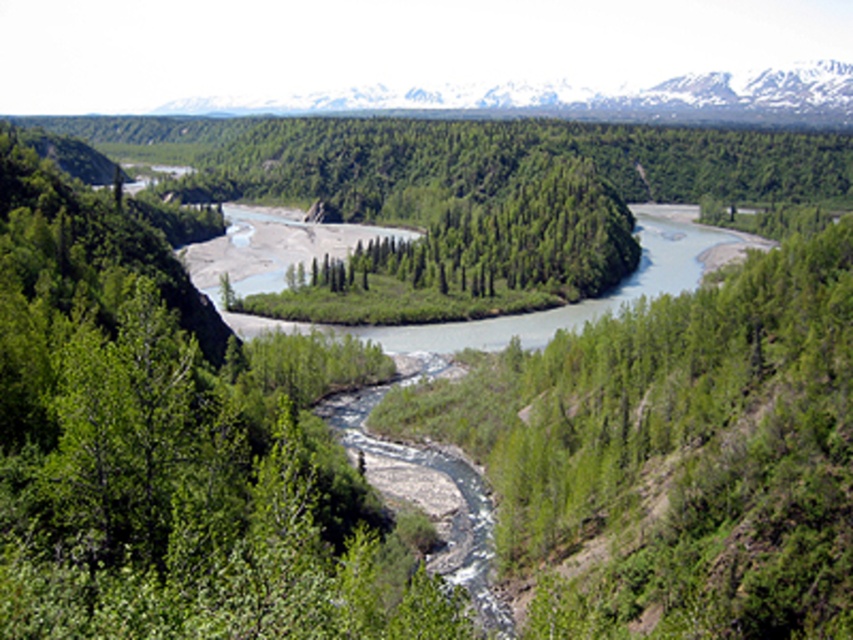
Who is positioned more to the left, snowy granite mountains at upper center or green leafy trees at center?

green leafy trees at center is more to the left.

Does snowy granite mountains at upper center have a lesser width compared to green leafy trees at center?

Incorrect, snowy granite mountains at upper center's width is not less than green leafy trees at center's.

Find the location of a particular element. The width and height of the screenshot is (853, 640). snowy granite mountains at upper center is located at coordinates (575, 99).